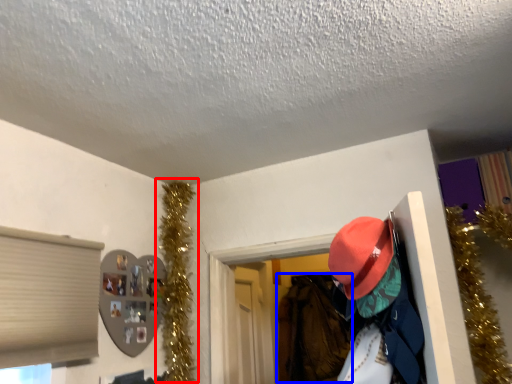
Question: Among these objects, which one is farthest to the camera, christmas decoration (highlighted by a red box) or clothing (highlighted by a blue box)?

Choices:
 (A) christmas decoration
 (B) clothing

Answer: (B)